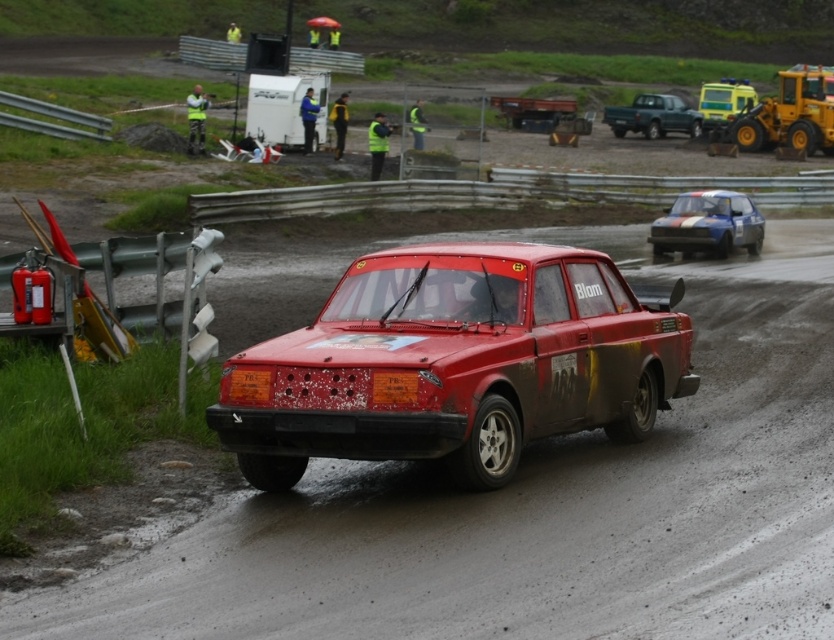
Question: Where is yellow rubber truck at upper right located in relation to blue metallic car at upper right in the image?

Choices:
 (A) left
 (B) right

Answer: (B)

Question: Is yellow rubber truck at upper right positioned before yellow reflective vest at upper left?

Choices:
 (A) no
 (B) yes

Answer: (A)

Question: Which point is closer to the camera taking this photo?

Choices:
 (A) (536, 372)
 (B) (192, 132)
 (C) (825, 134)
 (D) (667, 109)

Answer: (A)

Question: Which object appears closest to the camera in this image?

Choices:
 (A) blue metallic car at upper right
 (B) rusty metallic car at center
 (C) yellow reflective vest at upper left

Answer: (B)

Question: Is rusty metallic car at center bigger than yellow reflective vest at upper left?

Choices:
 (A) no
 (B) yes

Answer: (A)

Question: Among these points, which one is farthest from the camera?

Choices:
 (A) (676, 205)
 (B) (601, 364)
 (C) (656, 113)
 (D) (188, 109)

Answer: (C)